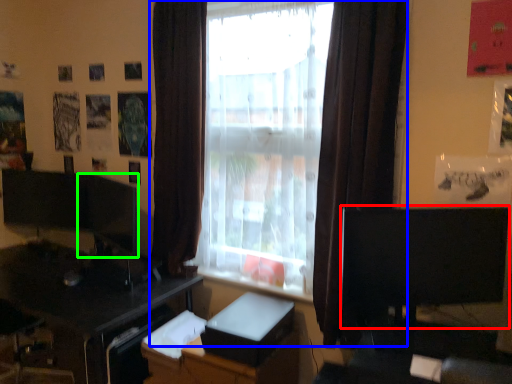
Question: Estimate the real-world distances between objects in this image. Which object is closer to computer monitor (highlighted by a red box), window (highlighted by a blue box) or computer monitor (highlighted by a green box)?

Choices:
 (A) window
 (B) computer monitor

Answer: (A)